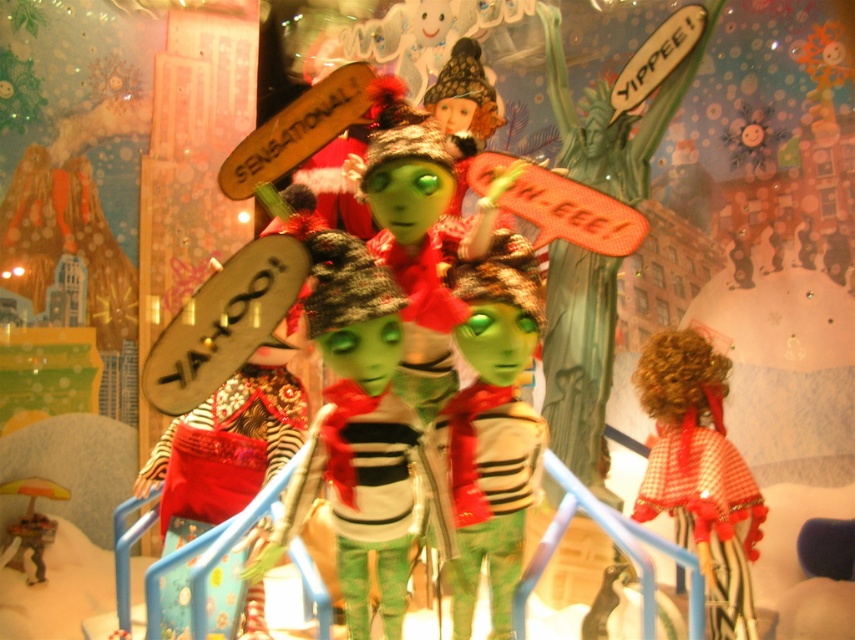
The height and width of the screenshot is (640, 855). What do you see at coordinates (357, 422) in the screenshot?
I see `matte green doll at center` at bounding box center [357, 422].

Does matte green doll at center have a lesser width compared to red plaid dress at right?

Indeed, matte green doll at center has a lesser width compared to red plaid dress at right.

Who is more forward, [340,529] or [677,499]?

Point [340,529] is more forward.

This screenshot has height=640, width=855. I want to click on matte green doll at center, so click(357, 422).

Between red plaid dress at right and metallic gold umbrella at lower left, which one appears on the left side from the viewer's perspective?

metallic gold umbrella at lower left is more to the left.

Between point (653, 477) and point (27, 540), which one is positioned behind?

The point (27, 540) is behind.

Where is `red plaid dress at right`? Image resolution: width=855 pixels, height=640 pixels. red plaid dress at right is located at coordinates pos(699,474).

Which is more to the right, matte green doll at center or metallic gold umbrella at lower left?

From the viewer's perspective, matte green doll at center appears more on the right side.

Between matte green doll at center and metallic gold umbrella at lower left, which one has less height?

metallic gold umbrella at lower left

Between point (335, 401) and point (46, 496), which one is positioned behind?

Positioned behind is point (46, 496).

Locate an element on the screen. matte green doll at center is located at coordinates (357, 422).